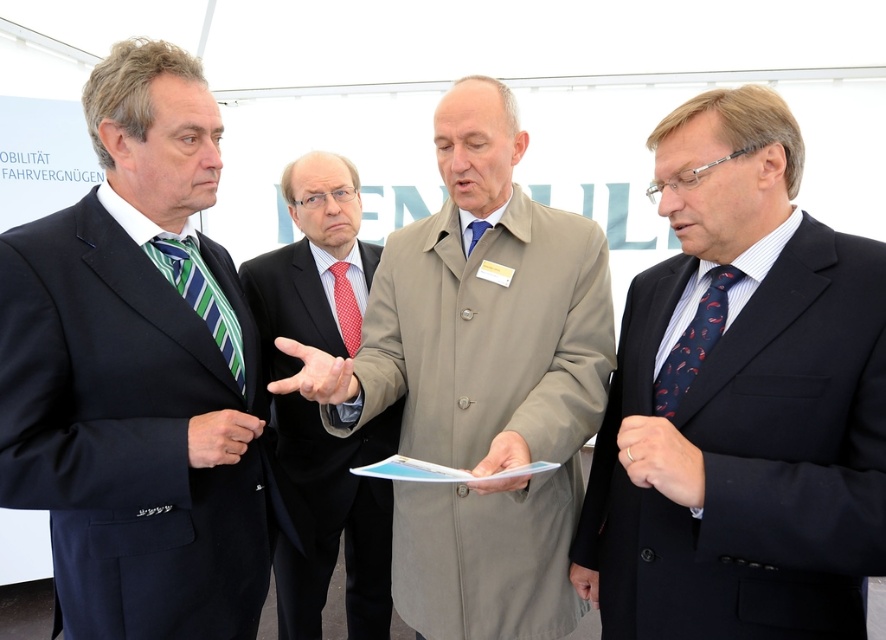
Looking at this image, you are standing at the origin point in the image. The dark blue suit at right is located at coordinates point (740, 401). Which direction should you move to reach the dark blue suit at right?

To reach the dark blue suit at right located at coordinates point (740, 401) from the origin, you should move towards the right direction since the x coordinate 0.628 is greater than 0.5, indicating it is to the right side of the image.

You are attending a professional event and notice two men in the scene. One is wearing a dark blue suit at right and the other a polished dark suit at center. Based on their positions, which man is standing closer to the front of the room?

The dark blue suit at right is positioned over the polished dark suit at center, meaning the dark blue suit at right is closer to the front of the room.